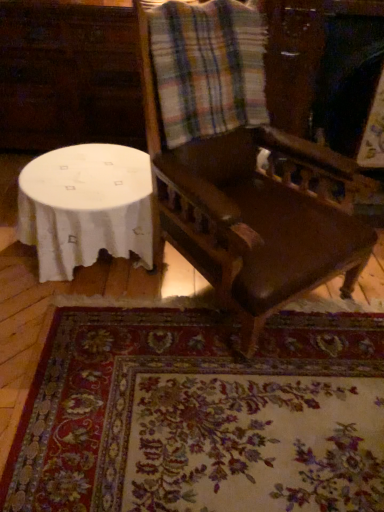
Find the location of `vacant area in front of dark brown wood chair at center`. vacant area in front of dark brown wood chair at center is located at coordinates (226, 405).